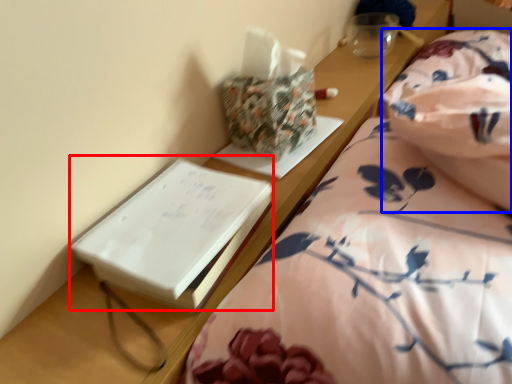
Question: Among these objects, which one is nearest to the camera, paperback book (highlighted by a red box) or blanket (highlighted by a blue box)?

Choices:
 (A) paperback book
 (B) blanket

Answer: (A)